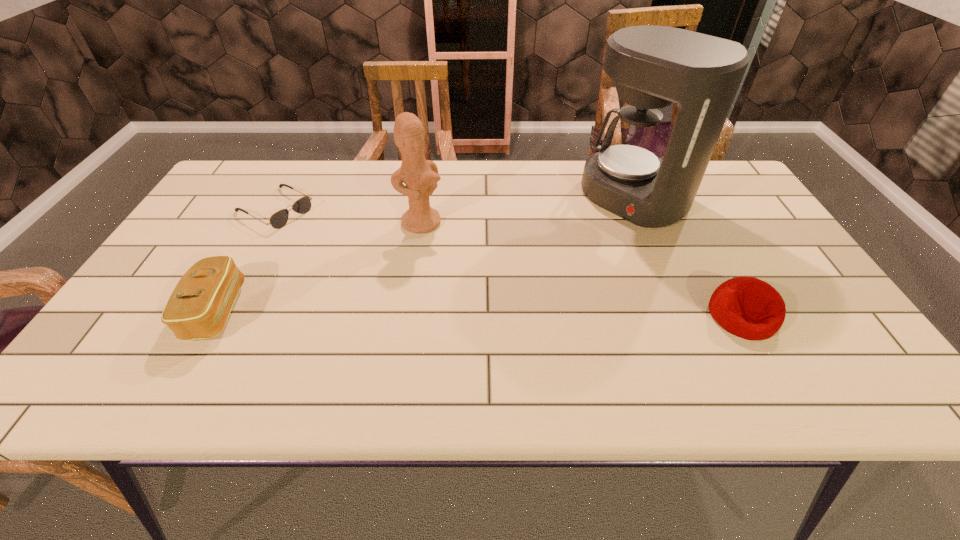
At what (x,y) coordinates should I click in order to perform the action: click on clutch bag situated at the left edge. Please return your answer as a coordinate pair (x, y). This screenshot has height=540, width=960. Looking at the image, I should click on (198, 308).

I want to click on sunglasses present at the left edge, so click(x=279, y=219).

Find the location of `object present at the right edge`. object present at the right edge is located at coordinates (747, 307).

Identify the location of object that is at the far left corner. The height and width of the screenshot is (540, 960). (279, 219).

Find the location of a particular element. This screenshot has height=540, width=960. object that is at the near left corner is located at coordinates (198, 308).

The image size is (960, 540). What are the coordinates of `object present at the near right corner` in the screenshot? It's located at (747, 307).

This screenshot has height=540, width=960. In the image, there is a desktop. Identify the location of vacant space at the far edge. (459, 171).

This screenshot has height=540, width=960. In the image, there is a desktop. In order to click on blank space at the near edge in this screenshot , I will do `click(723, 333)`.

The width and height of the screenshot is (960, 540). In order to click on vacant space at the right edge of the desktop in this screenshot , I will do `click(759, 238)`.

Image resolution: width=960 pixels, height=540 pixels. Identify the location of free space at the far left corner of the desktop. [271, 190].